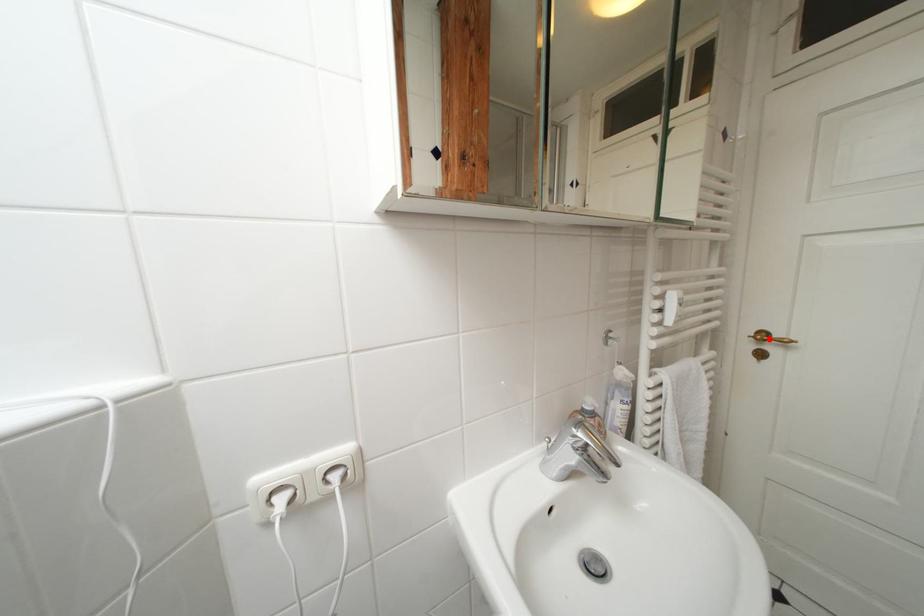
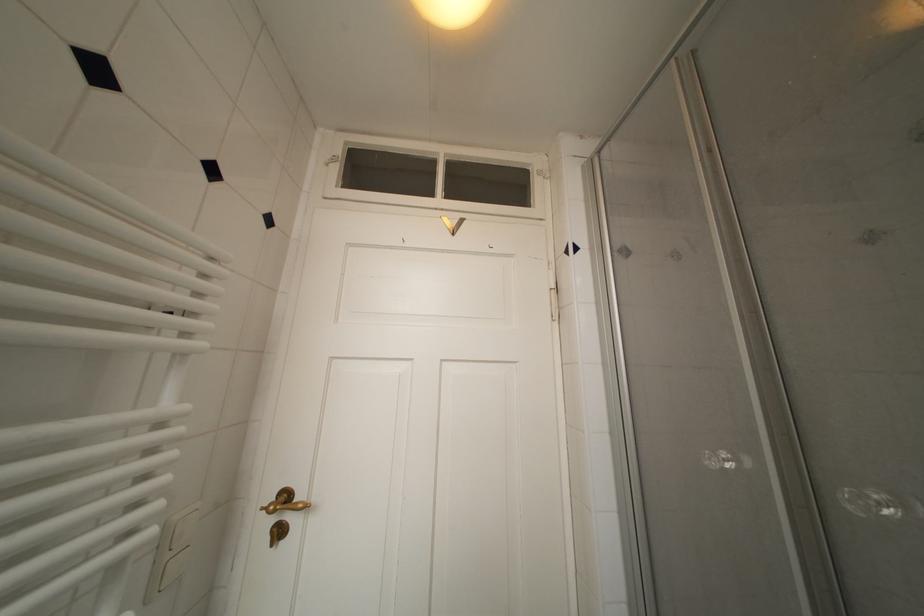
In the second image, find the point that corresponds to the highlighted location in the first image.

(293, 500)